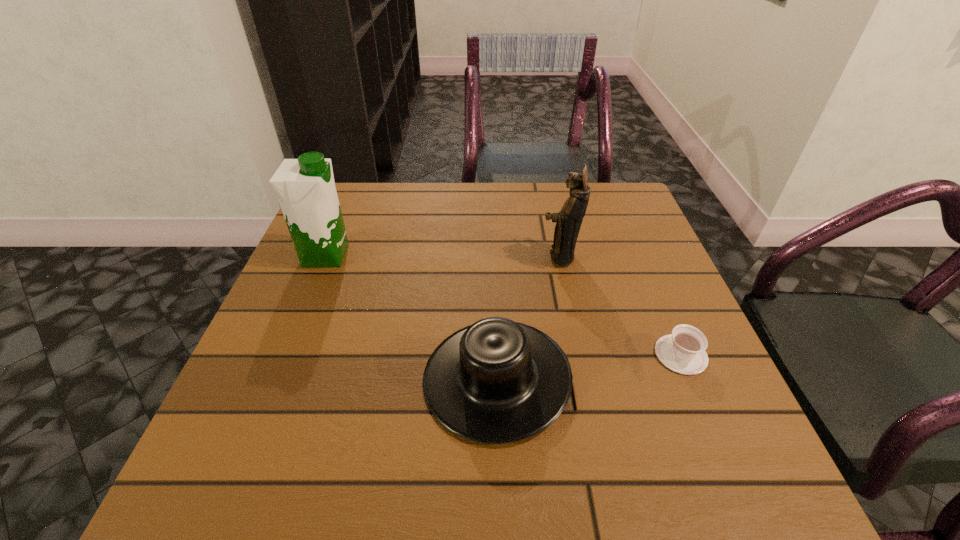
The image size is (960, 540). In order to click on free spot at the far left corner of the desktop in this screenshot , I will do `click(367, 217)`.

This screenshot has width=960, height=540. In the image, there is a desktop. What are the coordinates of `free space at the near left corner` in the screenshot? It's located at (233, 490).

The height and width of the screenshot is (540, 960). In the image, there is a desktop. Find the location of `vacant space at the far right corner`. vacant space at the far right corner is located at coordinates (626, 183).

You are a GUI agent. You are given a task and a screenshot of the screen. Output one action in this format:
    pyautogui.click(x=<x>, y=<y>)
    Task: Click on the free space at the near right corner of the desktop
    Image resolution: width=960 pixels, height=540 pixels.
    Given the screenshot: What is the action you would take?
    click(x=674, y=462)

The image size is (960, 540). What are the coordinates of `vacant space that is in between the soya milk and the figurine` in the screenshot? It's located at (443, 256).

The height and width of the screenshot is (540, 960). In order to click on vacant space that is in between the leftmost object and the dress hat in this screenshot , I will do `click(411, 316)`.

Identify the location of free space between the shortest object and the figurine. (620, 306).

Locate an element on the screen. The height and width of the screenshot is (540, 960). unoccupied position between the soya milk and the third tallest object is located at coordinates (411, 316).

Find the location of a particular element. blank region between the teacup and the dress hat is located at coordinates (588, 366).

The image size is (960, 540). I want to click on vacant region between the second shortest object and the teacup, so click(588, 366).